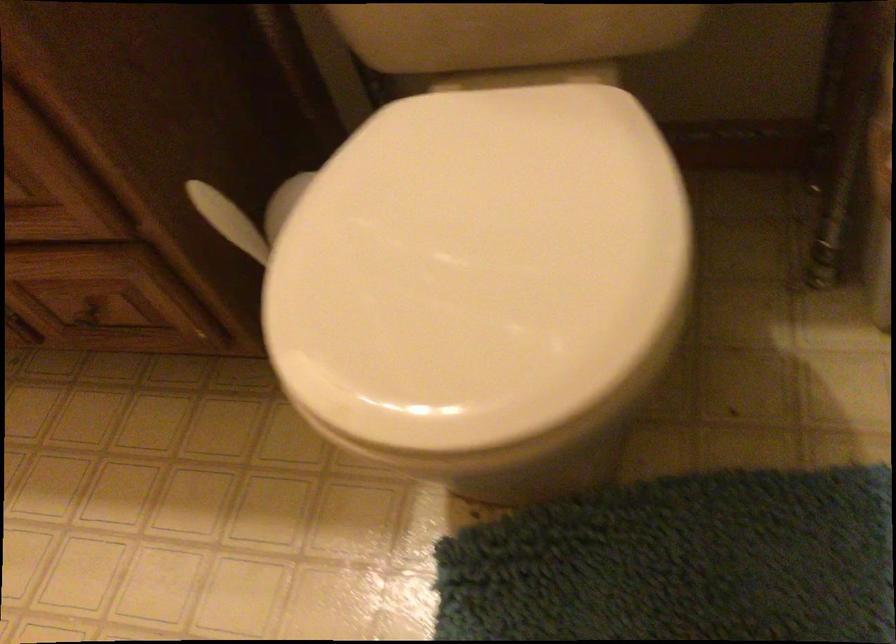
Find where to pull the cabinet door handle. Please return your answer as a coordinate pair (x, y).

(28, 330)